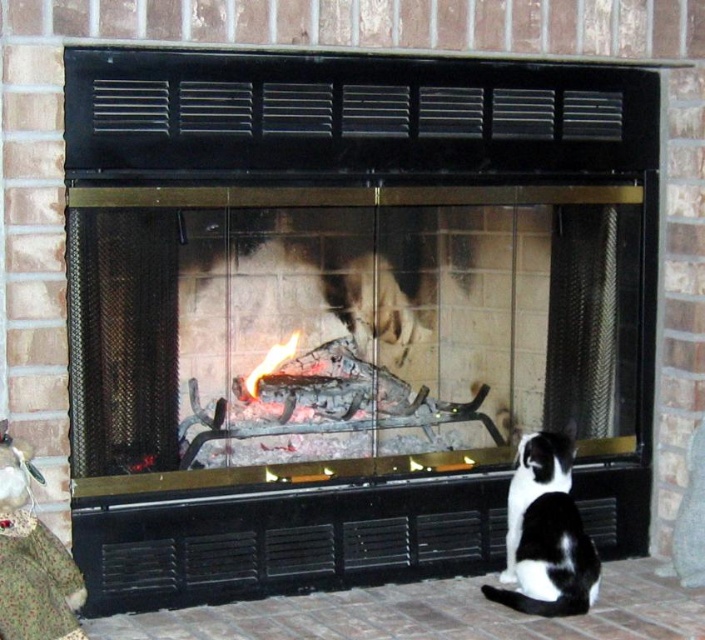
Which of these two, black and white fur cat at lower right or flamematerial/texture at center, stands shorter?

flamematerial/texture at center

Between point (522, 454) and point (264, 353), which one is positioned behind?

Positioned behind is point (264, 353).

Locate an element on the screen. black and white fur cat at lower right is located at coordinates (545, 534).

Where is `black and white fur cat at lower right`? black and white fur cat at lower right is located at coordinates (545, 534).